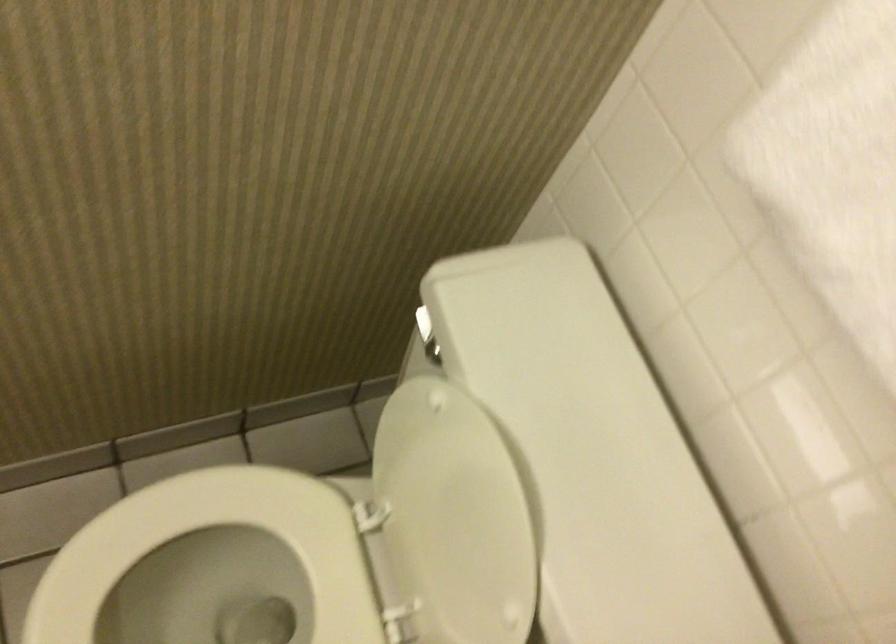
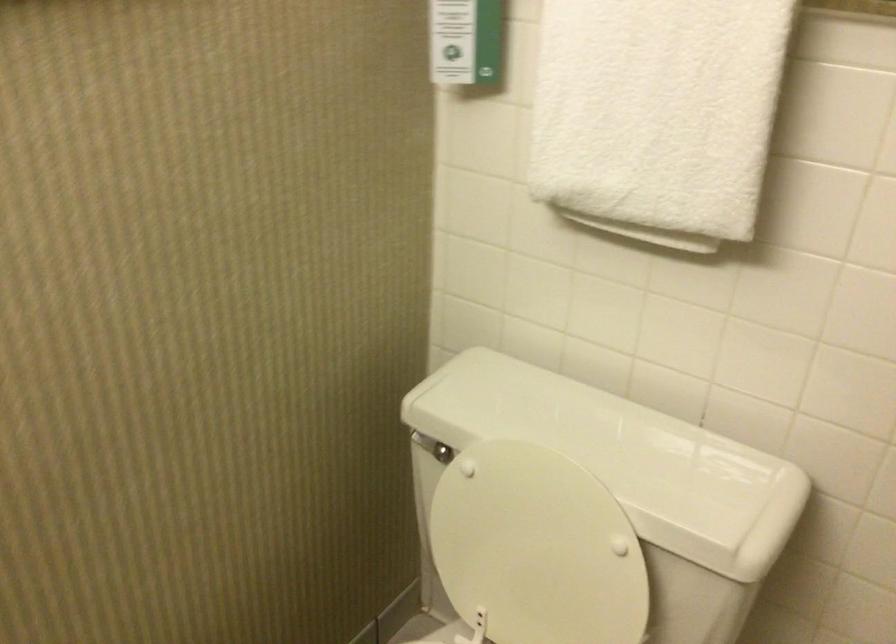
The point at (451, 520) is marked in the first image. Where is the corresponding point in the second image?

(536, 547)